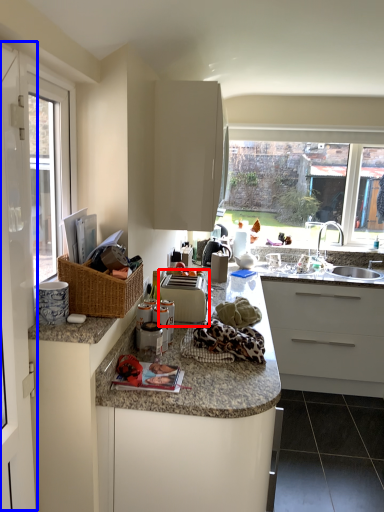
Question: Which object appears closest to the camera in this image, appliance (highlighted by a red box) or screen door (highlighted by a blue box)?

Choices:
 (A) appliance
 (B) screen door

Answer: (B)